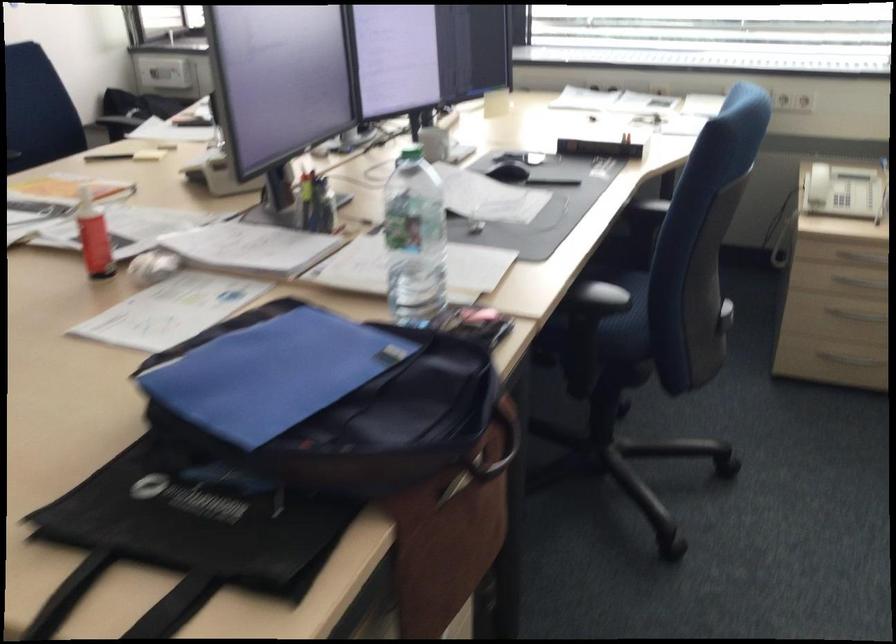
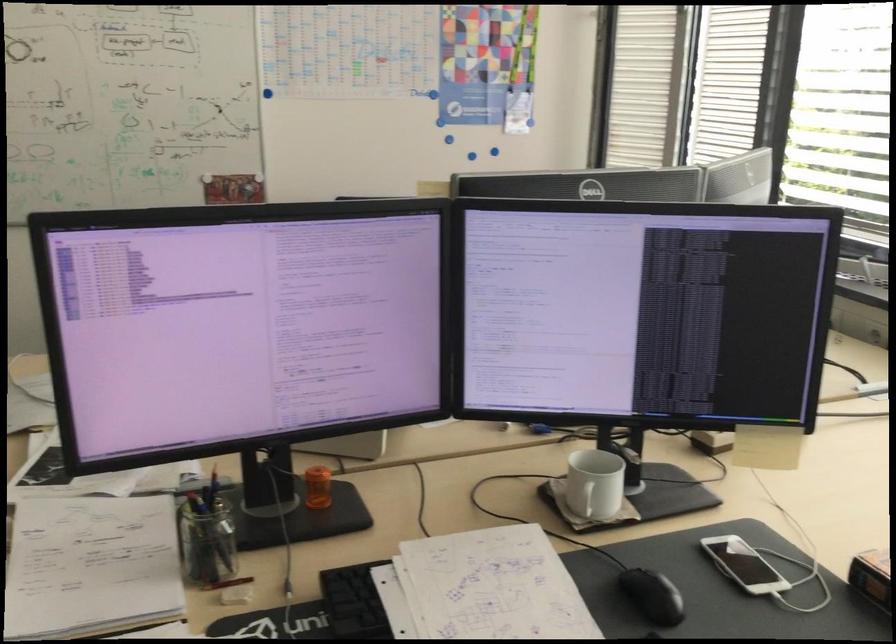
The point at [440,147] is marked in the first image. Where is the corresponding point in the second image?

(583, 498)